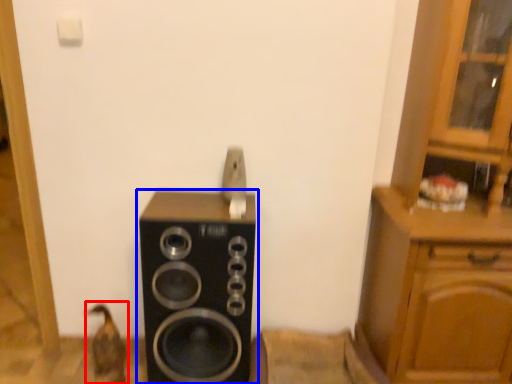
Question: Which of the following is the farthest to the observer, animal (highlighted by a red box) or home appliance (highlighted by a blue box)?

Choices:
 (A) animal
 (B) home appliance

Answer: (A)